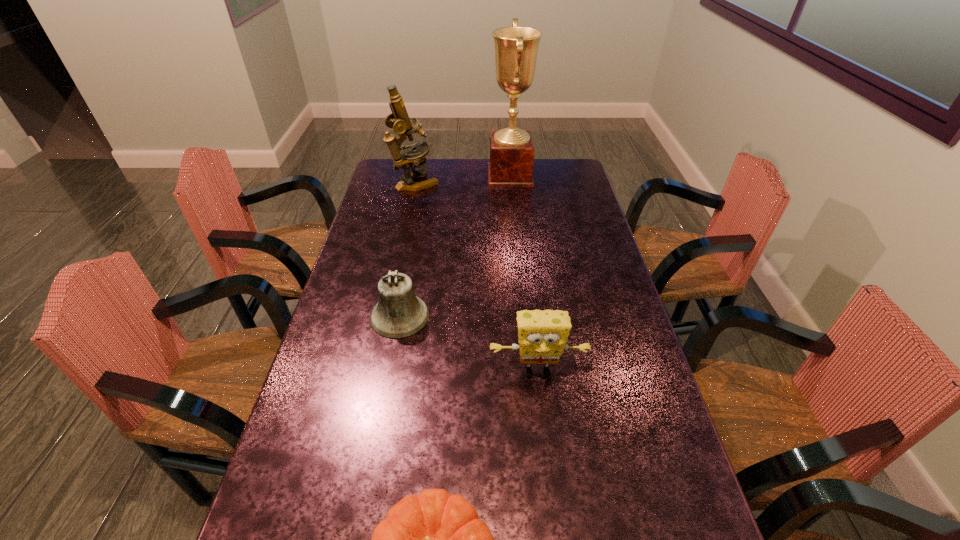
Where is `trophy cup`? The height and width of the screenshot is (540, 960). trophy cup is located at coordinates (512, 151).

Where is `microscope`? microscope is located at coordinates (399, 120).

Find the location of a particular element. This screenshot has width=960, height=540. the fourth farthest object is located at coordinates (543, 335).

Identify the location of bell. (398, 314).

The width and height of the screenshot is (960, 540). Identify the location of vacant space located 0.340m on the plaque of the trophy cup. (410, 176).

Locate an element on the screen. This screenshot has width=960, height=540. free region located 0.100m on the plaque of the trophy cup is located at coordinates (465, 176).

The image size is (960, 540). In order to click on free space located on the plaque of the trophy cup in this screenshot , I will do `click(474, 176)`.

At what (x,y) coordinates should I click in order to perform the action: click on vacant position located on the right of the fourth shortest object. Please return your answer as a coordinate pair (x, y). Image resolution: width=960 pixels, height=540 pixels. Looking at the image, I should click on (495, 183).

Identify the location of vacant space located on the face of the sponge. (545, 438).

Locate an element on the screen. vacant region located 0.170m on the back of the bell is located at coordinates (410, 261).